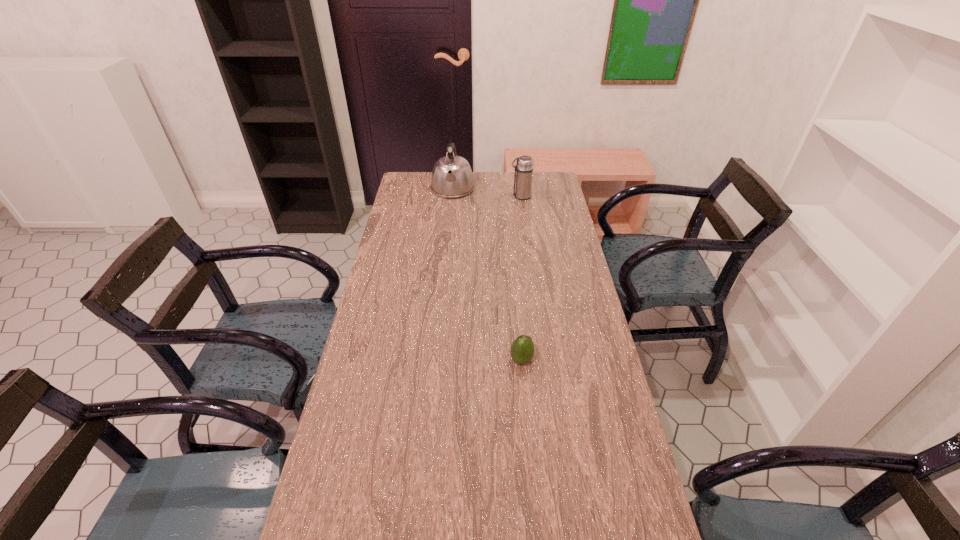
Find the location of `kettle that is at the far edge`. kettle that is at the far edge is located at coordinates (452, 177).

The image size is (960, 540). Find the location of `thermos bottle that is at the far edge`. thermos bottle that is at the far edge is located at coordinates (523, 177).

Image resolution: width=960 pixels, height=540 pixels. I want to click on object that is at the left edge, so click(452, 177).

The width and height of the screenshot is (960, 540). I want to click on object present at the right edge, so click(523, 177).

At what (x,y) coordinates should I click in order to perform the action: click on object present at the far left corner. Please return your answer as a coordinate pair (x, y). Looking at the image, I should click on (452, 177).

Where is `object located in the far right corner section of the desktop`? object located in the far right corner section of the desktop is located at coordinates (523, 177).

The image size is (960, 540). In the image, there is a desktop. Identify the location of vacant area at the far edge. (493, 197).

This screenshot has height=540, width=960. Identify the location of vacant space at the left edge of the desktop. (394, 210).

The width and height of the screenshot is (960, 540). Find the location of `vacant region at the right edge`. vacant region at the right edge is located at coordinates (550, 241).

Find the location of a particular element. free location at the far right corner of the desktop is located at coordinates (542, 183).